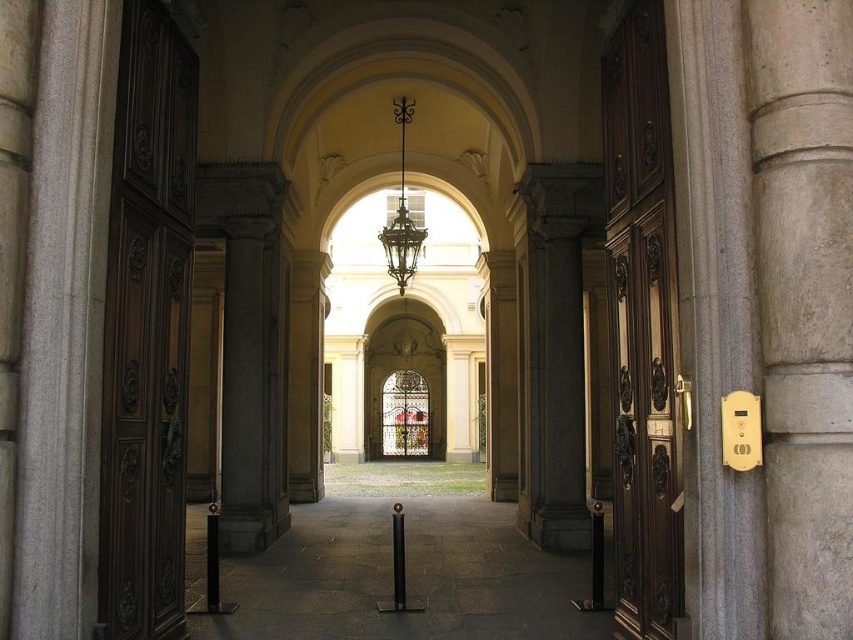
You are an interior designer planning to place a large antique mirror between the dark wood door at left and the polished dark wood door at right. Which door should the mirror be placed closer to, based on their sizes?

The polished dark wood door at right occupies more space than the dark wood door at left, so the mirror should be placed closer to the polished dark wood door at right to balance the visual weight.

You are a visitor standing at the entrance of the corridor. You need to reach the metallic wrought iron chandelier at center to adjust its light. However, there is a polished dark wood door at right in your path. Can you walk straight ahead without any obstacles to reach the chandelier?

The polished dark wood door at right is closer to the viewer than the metallic wrought iron chandelier at center, so you would encounter the door first before reaching the chandelier. Therefore, you cannot walk straight ahead without obstacles to reach the chandelier.

You are standing at the entrance of the corridor and want to take a photo that includes both point (166,237) and point (640,262). Since you want to ensure both are in focus, which point should you focus on to maximize the depth of field?

You should focus on point (640,262) because it is farther from the camera than point (166,237). By focusing on the farther point, you can ensure that both points are within the depth of field.